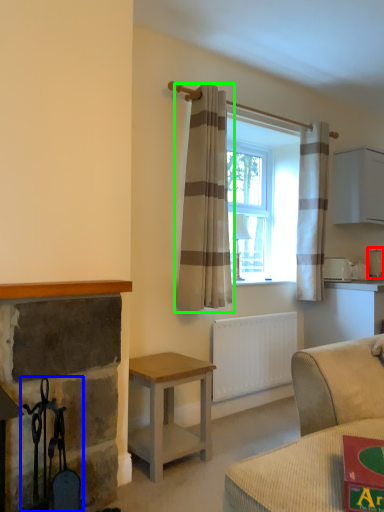
Question: Which object is the farthest from appliance (highlighted by a red box)? Choose among these: chair (highlighted by a blue box) or curtain (highlighted by a green box).

Choices:
 (A) chair
 (B) curtain

Answer: (A)